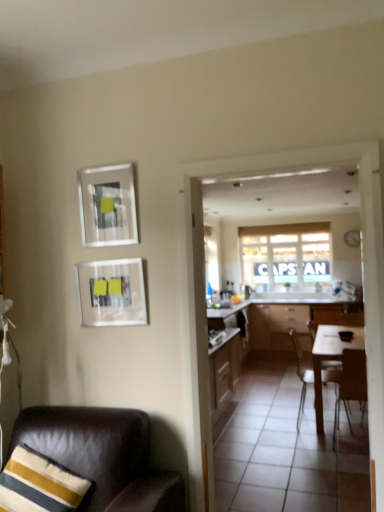
At what (x,y) coordinates should I click in order to perform the action: click on white fabric window at center. Please return your answer as a coordinate pair (x, y). This screenshot has height=512, width=384. Looking at the image, I should click on (286, 254).

You are a GUI agent. You are given a task and a screenshot of the screen. Output one action in this format:
    pyautogui.click(x=<x>, y=<y>)
    Task: Click on the white glossy countertop at center
    Image resolution: width=384 pixels, height=512 pixels.
    Given the screenshot: What is the action you would take?
    pyautogui.click(x=226, y=311)

Where is `matte glass picture frame at center-left, the 2th picture frame in the top-to-bottom sequence`? This screenshot has height=512, width=384. matte glass picture frame at center-left, the 2th picture frame in the top-to-bottom sequence is located at coordinates (112, 293).

Locate an element on the screen. The width and height of the screenshot is (384, 512). white fabric window at center is located at coordinates (286, 254).

Which of these two, white glossy countertop at center or leather chair at lower left, which appears as the 1th chair when viewed from the left, is wider?

leather chair at lower left, which appears as the 1th chair when viewed from the left, is wider.

Can you tell me how much white glossy countertop at center and leather chair at lower left, the 1th chair in the front-to-back sequence, differ in facing direction?

The angular difference between white glossy countertop at center and leather chair at lower left, the 1th chair in the front-to-back sequence, is 81.2 degrees.

From the image's perspective, which object appears higher, white glossy countertop at center or leather chair at lower left, positioned as the third chair in back-to-front order?

From the image's view, white glossy countertop at center is above.

Considering the positions of objects leather chair at lower left, the 1th chair in the front-to-back sequence, and wooden chair at center, the third chair from the front, in the image provided, who is in front, leather chair at lower left, the 1th chair in the front-to-back sequence, or wooden chair at center, the third chair from the front,?

leather chair at lower left, the 1th chair in the front-to-back sequence, is in front.

Between leather chair at lower left, positioned as the third chair in back-to-front order, and wooden chair at center, the first chair positioned from the back, which one has less height?

leather chair at lower left, positioned as the third chair in back-to-front order, is shorter.

Consider the image. From the image's perspective, is leather chair at lower left, positioned as the third chair in back-to-front order, located above wooden chair at center, the 2th chair from the left?

Yes, from the image's perspective, leather chair at lower left, positioned as the third chair in back-to-front order, is over wooden chair at center, the 2th chair from the left.

Is leather chair at lower left, the 1th chair in the front-to-back sequence, next to wooden chair at center, the 2th chair from the left?

No, leather chair at lower left, the 1th chair in the front-to-back sequence, is not making contact with wooden chair at center, the 2th chair from the left.

In the scene shown: Is wooden cabinets at center further to camera compared to white glossy countertop at center?

Yes.

Consider the image. Is wooden cabinets at center far from white glossy countertop at center?

Yes.

Is wooden cabinets at center outside of white glossy countertop at center?

Yes, wooden cabinets at center is not within white glossy countertop at center.

Is wooden cabinets at center thinner than white glossy countertop at center?

No.

Would you say wooden chair at center, the 2th chair from the left, is a long distance from leather chair at lower left, positioned as the third chair in back-to-front order?

wooden chair at center, the 2th chair from the left, is positioned a significant distance from leather chair at lower left, positioned as the third chair in back-to-front order.

Is wooden chair at center, the third chair from the front, oriented away from leather chair at lower left, arranged as the third chair when viewed from the right?

No, leather chair at lower left, arranged as the third chair when viewed from the right, is not at the back of wooden chair at center, the third chair from the front.

From the image's perspective, which chair is the 2nd one above the wooden chair at center, the first chair positioned from the back? Please provide its 2D coordinates.

[(102, 455)]

Is wooden cabinets at center with brown wooden chair at right, the second chair positioned from the back?

No, wooden cabinets at center is not touching brown wooden chair at right, the second chair positioned from the back.

Is wooden cabinets at center inside or outside of brown wooden chair at right, the 3th chair in the left-to-right sequence?

wooden cabinets at center is spatially situated outside brown wooden chair at right, the 3th chair in the left-to-right sequence.

Is wooden cabinets at center taller than brown wooden chair at right, the second chair positioned from the back?

Yes.

Between point (25, 470) and point (306, 461), which one is positioned behind?

Positioned behind is point (306, 461).

Based on the photo, considering the relative sizes of striped fabric pillow at lower left and white glossy tile at center in the image provided, is striped fabric pillow at lower left thinner than white glossy tile at center?

Yes.

Who is bigger, striped fabric pillow at lower left or white glossy tile at center?

white glossy tile at center.

Is point (270, 317) closer or farther from the camera than point (103, 271)?

Point (270, 317) is farther from the camera than point (103, 271).

Consider the image. Considering their positions, is wooden cabinets at center located in front of or behind matte glass picture frame at center-left, the 2th picture frame in the top-to-bottom sequence?

Visually, wooden cabinets at center is located behind matte glass picture frame at center-left, the 2th picture frame in the top-to-bottom sequence.

Who is bigger, wooden cabinets at center or matte glass picture frame at center-left, acting as the first picture frame starting from the bottom?

wooden cabinets at center.

Is wooden cabinets at center at the right side of matte glass picture frame at center-left, acting as the first picture frame starting from the bottom?

Indeed, wooden cabinets at center is positioned on the right side of matte glass picture frame at center-left, acting as the first picture frame starting from the bottom.

From the image's perspective, which chair is the 1st one below the white glossy countertop at center? Please provide its 2D coordinates.

[(102, 455)]

Where is `the 2nd chair directly beneath the leather chair at lower left, the 1th chair in the front-to-back sequence (from a real-world perspective)`? The width and height of the screenshot is (384, 512). the 2nd chair directly beneath the leather chair at lower left, the 1th chair in the front-to-back sequence (from a real-world perspective) is located at coordinates (302, 370).

Considering their positions, is wooden chair at center, the 2th chair from the left, positioned further to white fabric window at center than striped fabric pillow at lower left?

Based on the image, striped fabric pillow at lower left appears to be further to white fabric window at center.

Looking at the image, which one is located further to wooden chair at center, the first chair positioned from the back, white fabric window at center or white glossy tile at center?

Among the two, white fabric window at center is located further to wooden chair at center, the first chair positioned from the back.

Looking at the image, which one is located further to striped fabric pillow at lower left, leather chair at lower left, arranged as the third chair when viewed from the right, or brown wooden chair at right, the 2th chair positioned from the front?

Among the two, brown wooden chair at right, the 2th chair positioned from the front, is located further to striped fabric pillow at lower left.

Estimate the real-world distances between objects in this image. Which object is further from striped fabric pillow at lower left, matte glass picture frame at upper left, acting as the first picture frame starting from the top, or white glossy tile at center?

Among the two, white glossy tile at center is located further to striped fabric pillow at lower left.

Looking at the image, which one is located closer to brown wooden chair at right, acting as the first chair starting from the right, matte glass picture frame at center-left, acting as the first picture frame starting from the bottom, or wooden cabinets at center?

matte glass picture frame at center-left, acting as the first picture frame starting from the bottom, is closer to brown wooden chair at right, acting as the first chair starting from the right.

Looking at the image, which one is located further to white glossy tile at center, brown wooden chair at right, the second chair positioned from the back, or white fabric window at center?

white fabric window at center is positioned further to the anchor white glossy tile at center.

Consider the image. When comparing their distances from matte glass picture frame at center-left, acting as the first picture frame starting from the bottom, does wooden cabinets at center or white glossy countertop at center seem further?

wooden cabinets at center is positioned further to the anchor matte glass picture frame at center-left, acting as the first picture frame starting from the bottom.

Which object lies nearer to the anchor point white glossy tile at center, wooden chair at center, the 2th chair from the left, or matte glass picture frame at center-left, the 2th picture frame in the top-to-bottom sequence?

wooden chair at center, the 2th chair from the left, lies closer to white glossy tile at center than the other object.

You are a GUI agent. You are given a task and a screenshot of the screen. Output one action in this format:
    pyautogui.click(x=<x>, y=<y>)
    Task: Click on the chair between brown wooden chair at right, the second chair positioned from the back, and wooden cabinets at center, along the z-axis
    
    Given the screenshot: What is the action you would take?
    pyautogui.click(x=302, y=370)

Where is `tile between leather chair at lower left, arranged as the third chair when viewed from the right, and brown wooden chair at right, the 3th chair in the left-to-right sequence, along the z-axis`? The width and height of the screenshot is (384, 512). tile between leather chair at lower left, arranged as the third chair when viewed from the right, and brown wooden chair at right, the 3th chair in the left-to-right sequence, along the z-axis is located at coordinates (288, 450).

Locate an element on the screen. Image resolution: width=384 pixels, height=512 pixels. counter top between matte glass picture frame at upper left, marked as the second picture frame in a bottom-to-top arrangement, and white fabric window at center in the front-back direction is located at coordinates (226, 311).

The height and width of the screenshot is (512, 384). Identify the location of chair positioned between leather chair at lower left, which appears as the 1th chair when viewed from the left, and wooden chair at center, the third chair from the front, from near to far. (350, 384).